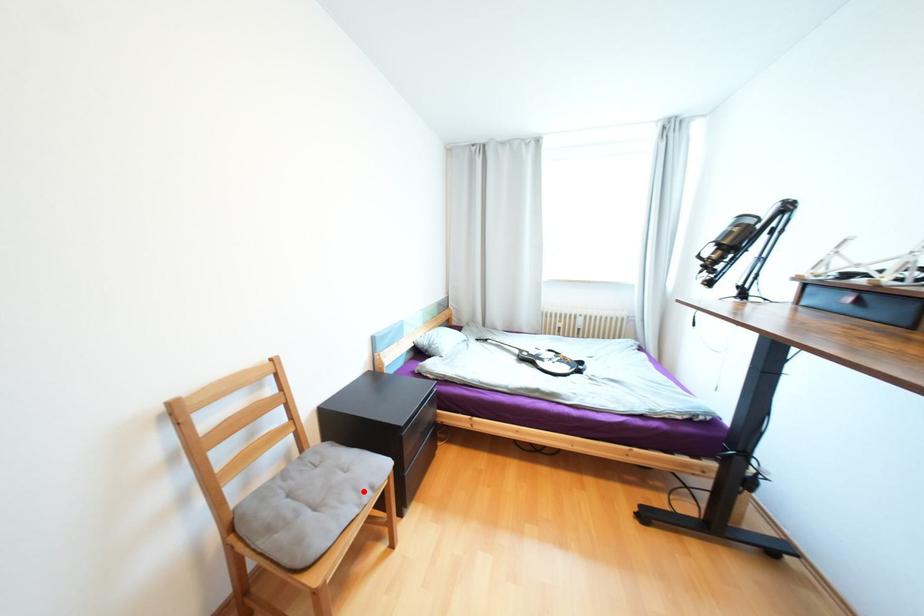
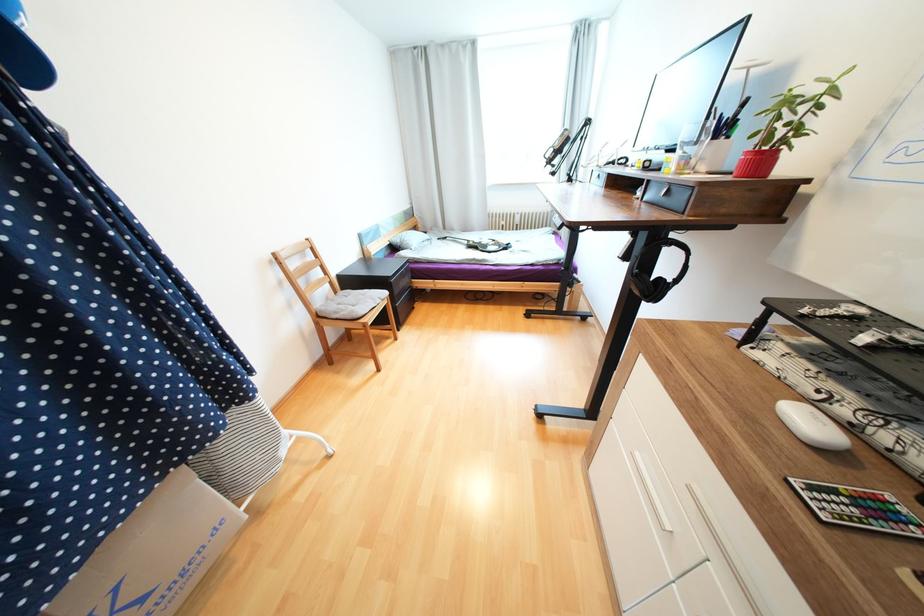
Find the pixel in the second image that matches the highlighted location in the first image.

(379, 300)